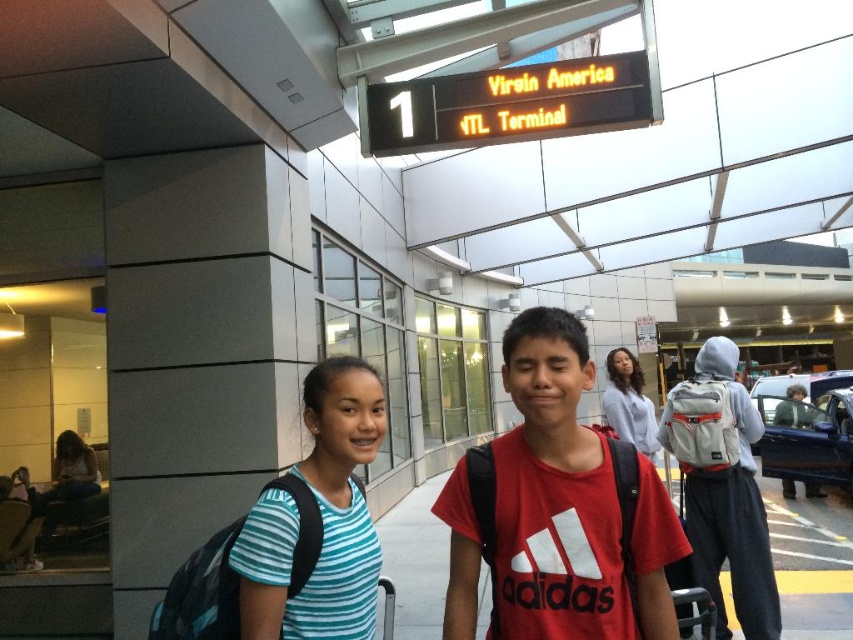
Question: Is the position of striped fabric shirt at center less distant than that of teal striped shirt at center?

Choices:
 (A) yes
 (B) no

Answer: (B)

Question: Which of the following is the closest to the observer?

Choices:
 (A) red matte adidas shirt at center
 (B) striped fabric shirt at center
 (C) teal striped shirt at center

Answer: (A)

Question: Is red matte adidas shirt at center to the left of teal striped shirt at center from the viewer's perspective?

Choices:
 (A) no
 (B) yes

Answer: (A)

Question: Which object is positioned farthest from the teal striped shirt at center?

Choices:
 (A) red matte adidas shirt at center
 (B) striped fabric shirt at center

Answer: (B)

Question: Can you confirm if striped fabric shirt at center is positioned to the right of red matte adidas shirt at center?

Choices:
 (A) yes
 (B) no

Answer: (A)

Question: Which point is closer to the camera taking this photo?

Choices:
 (A) (548, 332)
 (B) (527, 385)
 (C) (262, 580)

Answer: (C)